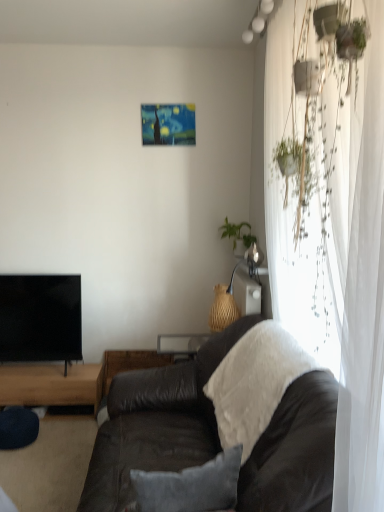
Question: From the image's perspective, is white sheer curtain at right located above woven wood table at center, which is counted as the 1th table, starting from the right?

Choices:
 (A) yes
 (B) no

Answer: (A)

Question: Does white sheer curtain at right have a larger size compared to woven wood table at center, which is counted as the 1th table, starting from the right?

Choices:
 (A) yes
 (B) no

Answer: (A)

Question: Are white sheer curtain at right and woven wood table at center, which is counted as the 1th table, starting from the right, making contact?

Choices:
 (A) yes
 (B) no

Answer: (B)

Question: From a real-world perspective, is white sheer curtain at right on woven wood table at center, which is counted as the 1th table, starting from the right?

Choices:
 (A) no
 (B) yes

Answer: (B)

Question: Is the position of white sheer curtain at right less distant than that of woven wood table at center, the second table in the left-to-right sequence?

Choices:
 (A) yes
 (B) no

Answer: (A)

Question: Does white sheer curtain at right lie behind woven wood table at center, which is counted as the 1th table, starting from the right?

Choices:
 (A) no
 (B) yes

Answer: (A)

Question: Is brown wooden table at lower left, which appears as the first table when viewed from the left, facing towards woven wood table at center, the second table in the left-to-right sequence?

Choices:
 (A) no
 (B) yes

Answer: (A)

Question: Considering the relative sizes of brown wooden table at lower left, which appears as the first table when viewed from the left, and woven wood table at center, which is counted as the 1th table, starting from the right, in the image provided, is brown wooden table at lower left, which appears as the first table when viewed from the left, thinner than woven wood table at center, which is counted as the 1th table, starting from the right,?

Choices:
 (A) no
 (B) yes

Answer: (A)

Question: Is brown wooden table at lower left, which appears as the first table when viewed from the left, further to camera compared to woven wood table at center, which is counted as the 1th table, starting from the right?

Choices:
 (A) yes
 (B) no

Answer: (B)

Question: Would you say brown wooden table at lower left, placed as the second table when sorted from right to left, contains woven wood table at center, the second table in the left-to-right sequence?

Choices:
 (A) no
 (B) yes

Answer: (A)

Question: From a real-world perspective, is brown wooden table at lower left, which appears as the first table when viewed from the left, located beneath woven wood table at center, which is counted as the 1th table, starting from the right?

Choices:
 (A) no
 (B) yes

Answer: (B)

Question: Is brown wooden table at lower left, which appears as the first table when viewed from the left, looking in the opposite direction of woven wood table at center, the second table in the left-to-right sequence?

Choices:
 (A) no
 (B) yes

Answer: (A)

Question: Is black glossy tv at left closer to the viewer compared to green leafy plant at upper right?

Choices:
 (A) yes
 (B) no

Answer: (B)